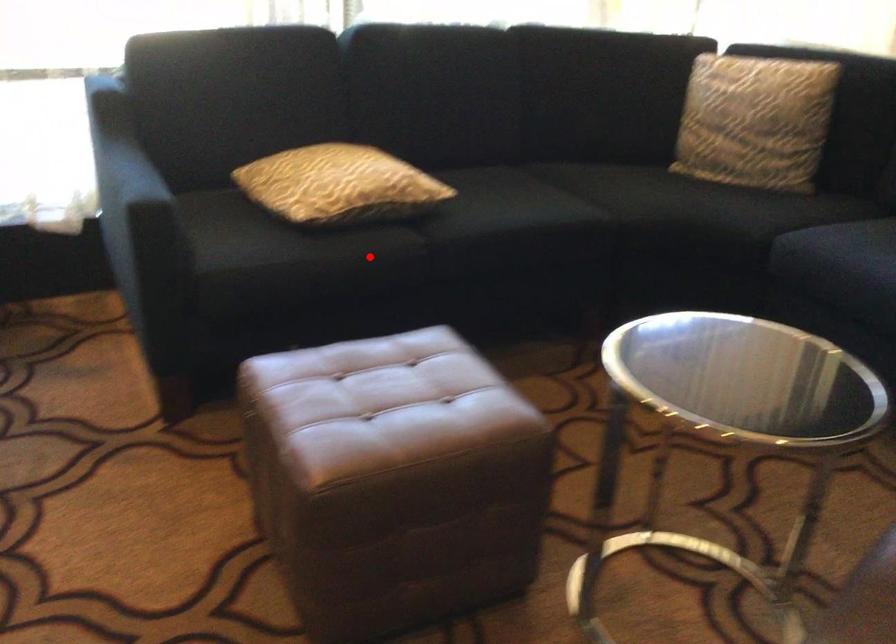
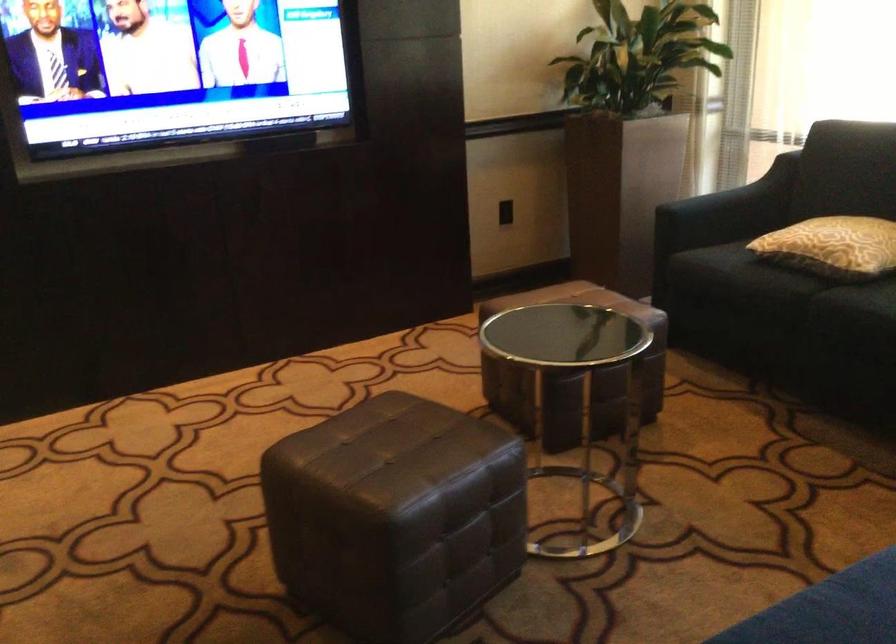
Question: I am providing you with two images of the same scene from different viewpoints. In image1, a red point is highlighted. Considering the same 3D point in image2, which of the following is correct?

Choices:
 (A) It is closer
 (B) It is farther

Answer: (B)